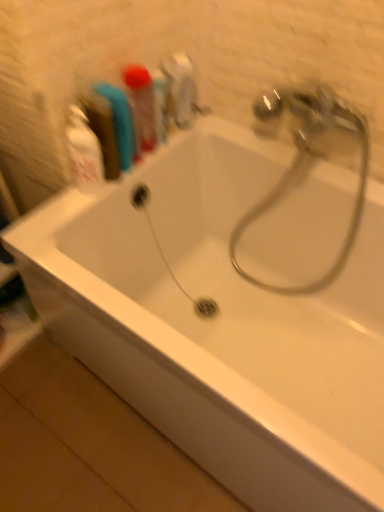
Question: Is blue rubber toothbrush at upper left, which is the first toiletry in left-to-right order, bigger or smaller than polished chrome tap at upper right?

Choices:
 (A) big
 (B) small

Answer: (B)

Question: From their relative heights in the image, would you say blue rubber toothbrush at upper left, which is counted as the 2th toiletry, starting from the right, is taller or shorter than polished chrome tap at upper right?

Choices:
 (A) short
 (B) tall

Answer: (A)

Question: Estimate the real-world distances between objects in this image. Which object is farther from the polished chrome tap at upper right?

Choices:
 (A) white glossy bottle at upper left
 (B) translucent plastic toothbrush at upper left, which is the second toiletry in left-to-right order
 (C) blue rubber toothbrush at upper left, which is counted as the 2th toiletry, starting from the right

Answer: (A)

Question: Which is nearer to the white glossy bottle at upper left?

Choices:
 (A) polished chrome tap at upper right
 (B) translucent plastic toothbrush at upper left, which is the second toiletry in left-to-right order
 (C) blue rubber toothbrush at upper left, which is counted as the 2th toiletry, starting from the right

Answer: (C)